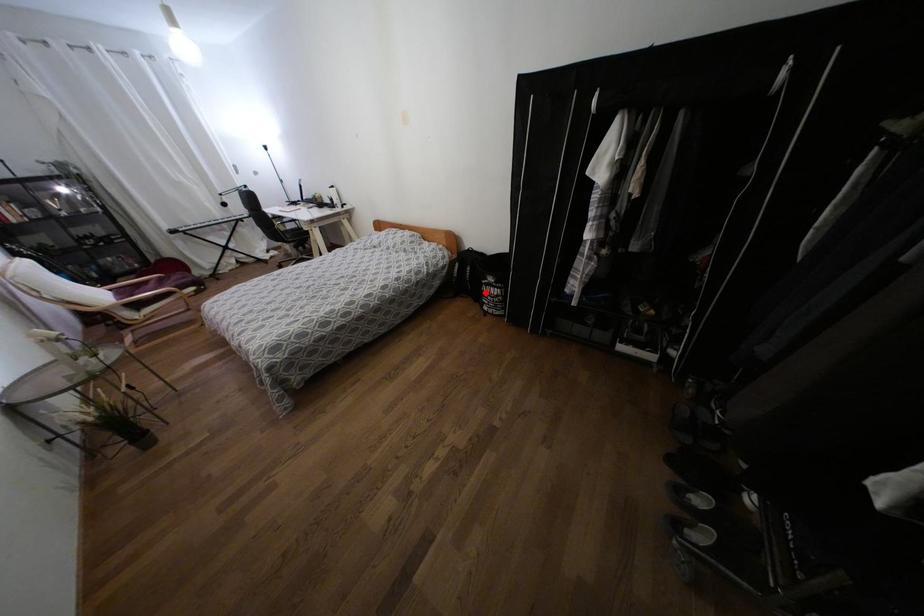
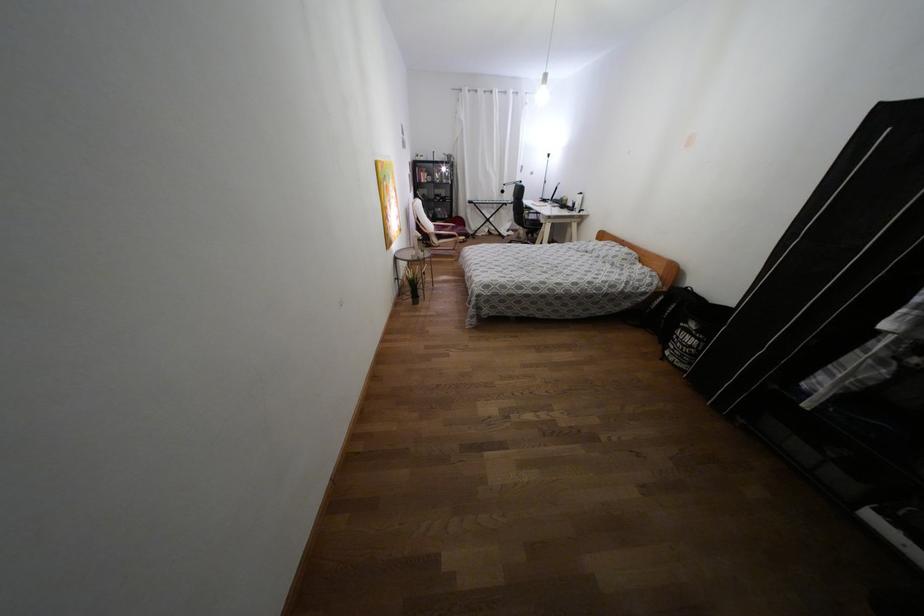
Where in the second image is the point corresponding to the highlighted location from the first image?

(676, 337)